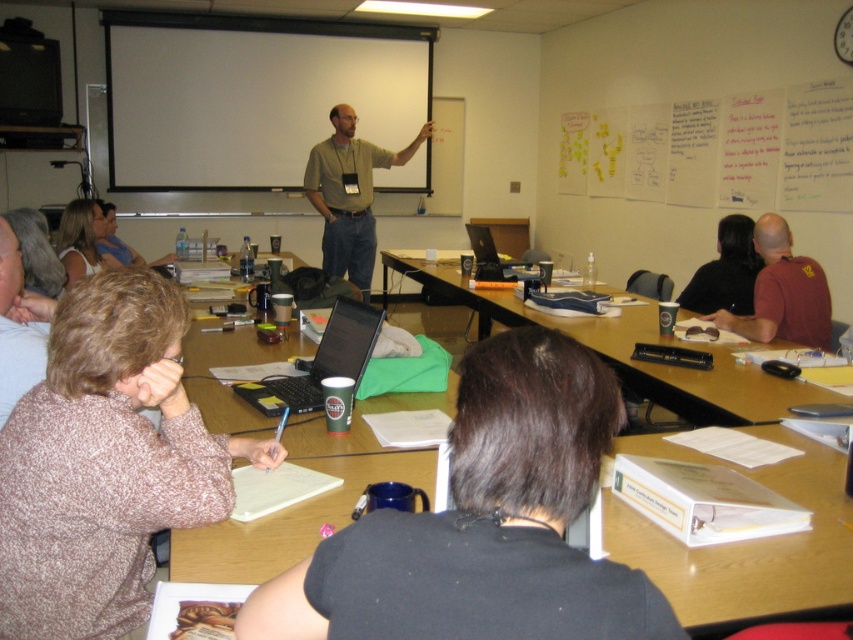
Can you confirm if matte khaki shirt at center is shorter than matte white blouse at upper left?

Incorrect, matte khaki shirt at center's height does not fall short of matte white blouse at upper left's.

Can you confirm if matte khaki shirt at center is smaller than matte white blouse at upper left?

No, matte khaki shirt at center is not smaller than matte white blouse at upper left.

Find the location of a particular element. The height and width of the screenshot is (640, 853). matte khaki shirt at center is located at coordinates (349, 195).

Is black plastic laptop at center further to camera compared to shiny black laptop at center?

No, black plastic laptop at center is closer to the viewer.

Between point (282, 385) and point (511, 262), which one is positioned in front?

Point (282, 385) is in front.

Where is `black plastic laptop at center`? This screenshot has height=640, width=853. black plastic laptop at center is located at coordinates [321, 362].

Which is below, white paper at upper center or brown leather shirt at right?

brown leather shirt at right is lower down.

Does point (573, 154) lie in front of point (793, 285)?

No, it is behind (793, 285).

Identify the location of white paper at upper center. (718, 150).